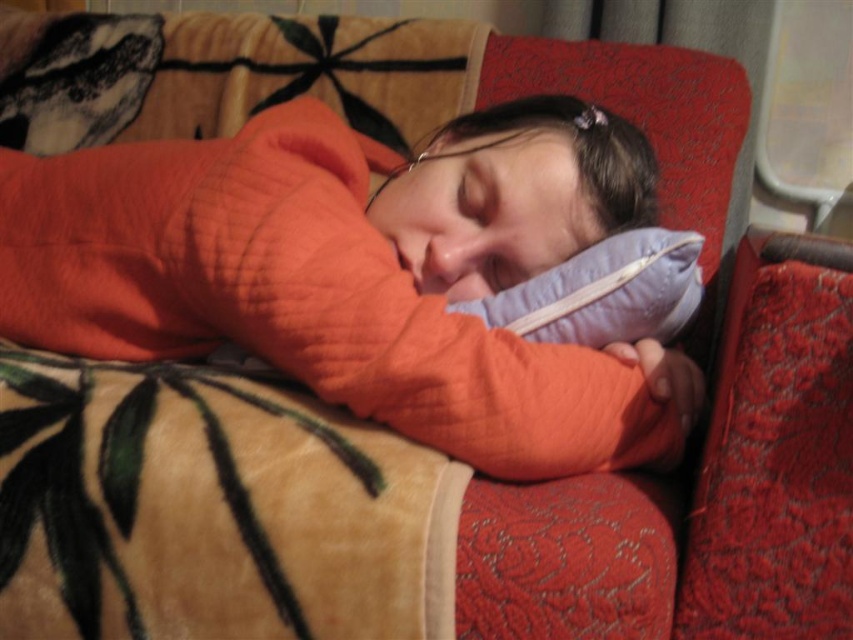
You are a housekeeper entering a room and see the orange quilted sweater at center and the purple fabric pillow at center. Which object is positioned higher relative to the other?

The orange quilted sweater at center is above the purple fabric pillow at center, so it is positioned higher.

You are a housekeeper entering a room and see the orange quilted sweater at center and the purple fabric pillow at center. Which object takes up more space in the scene?

The orange quilted sweater at center has a larger size compared to the purple fabric pillow at center, so it takes up more space in the scene.

You are standing in a room with a couch and a white chair. You notice an object at point (358, 273). What is the object located at that coordinate?

The object at point (358, 273) is the orange quilted sweater at center.